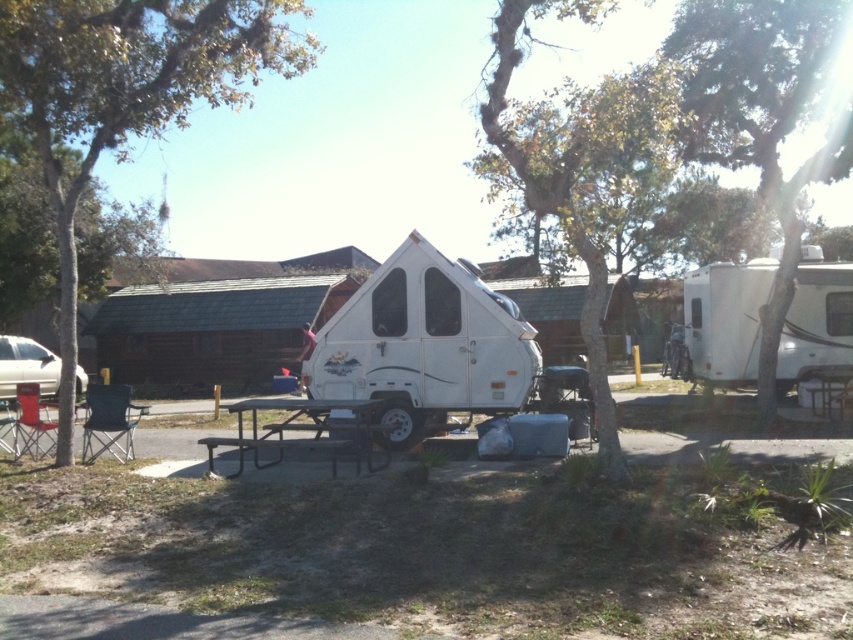
You are planning to set up a tent between the green leafy tree at center and the metallic silver car at left. Given that the tent requires at least 80 feet of space to be placed safely, will there be enough space between them?

The distance between the green leafy tree at center and the metallic silver car at left is 76.07 feet, which is less than the required 80 feet. Therefore, there isn not enough space to safely set up the tent between them.

In the scene shown: You are standing at the edge of the grassy area near the white glossy camper at right and the metallic silver picnic table at center. Which object is closer to you?

The white glossy camper at right is closer to you because it is positioned further to the viewer than the metallic silver picnic table at center, meaning it appears nearer in the scene.

You are planning to take a photo of the green leafy tree at center and the metallic silver car at left from a position where both are visible. Based on their sizes, which one would appear bigger in the photo?

The green leafy tree at center would appear bigger in the photo since it is larger in size than the metallic silver car at left.